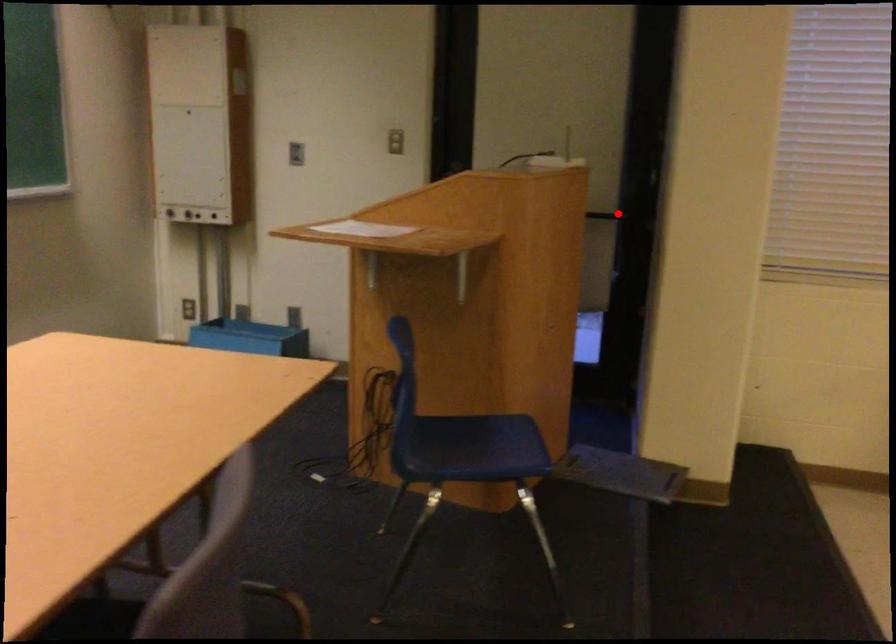
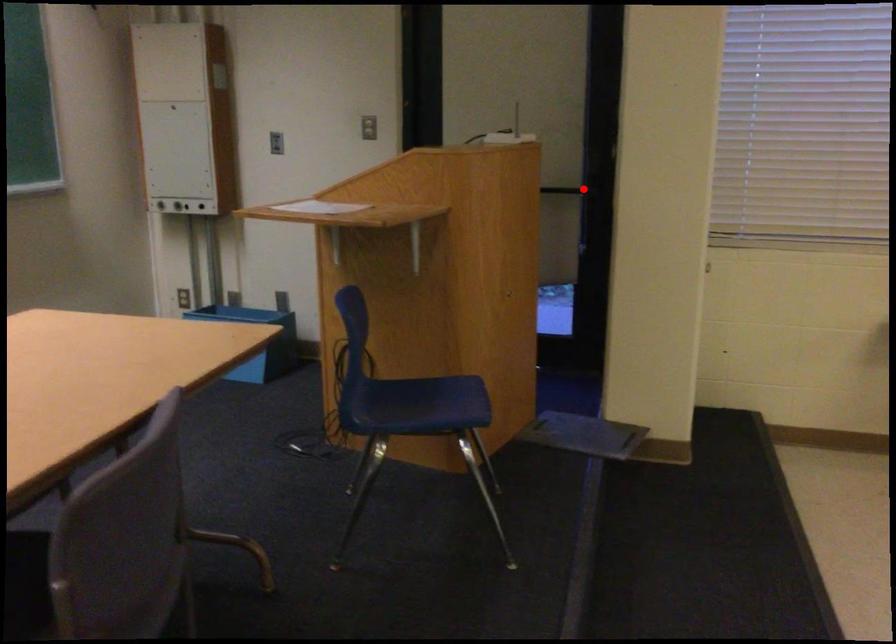
I am providing you with two images of the same scene from different viewpoints. A red point is marked on the first image and another point is marked on the second image. Do the highlighted points in image1 and image2 indicate the same real-world spot?

Yes